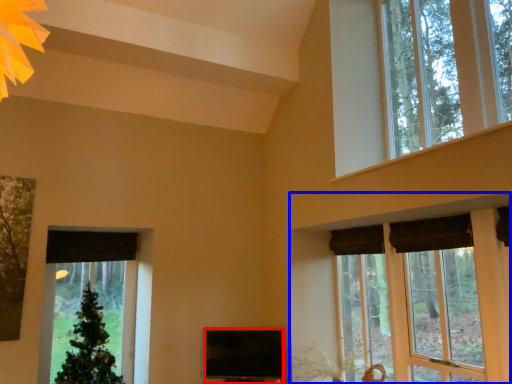
Question: Which object appears farthest to the camera in this image, window screen (highlighted by a red box) or window (highlighted by a blue box)?

Choices:
 (A) window screen
 (B) window

Answer: (A)